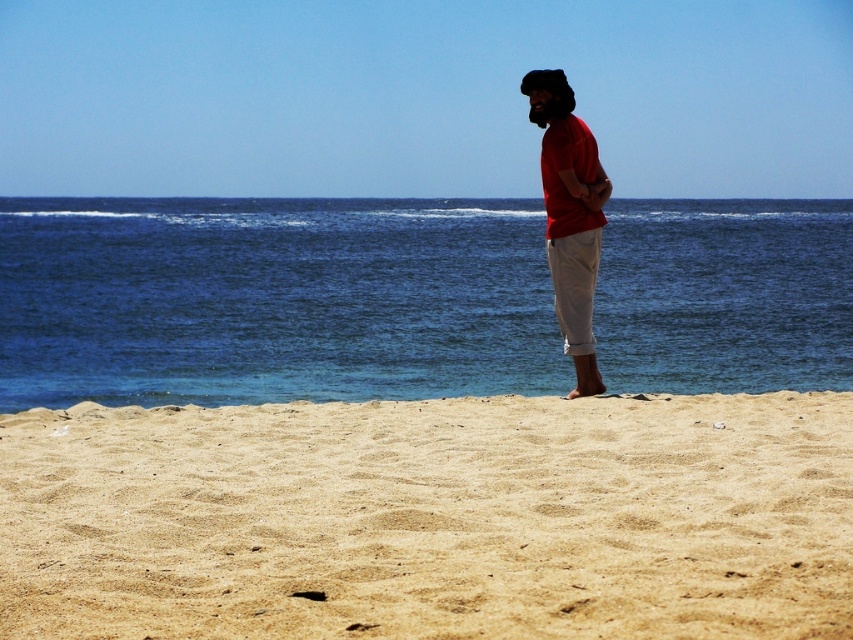
Looking at this image, you are a photographer trying to capture a shot of the blue water at center and the matte red shirt at center. How far apart are these two objects in the scene?

The blue water at center and the matte red shirt at center are 157.15 feet apart.